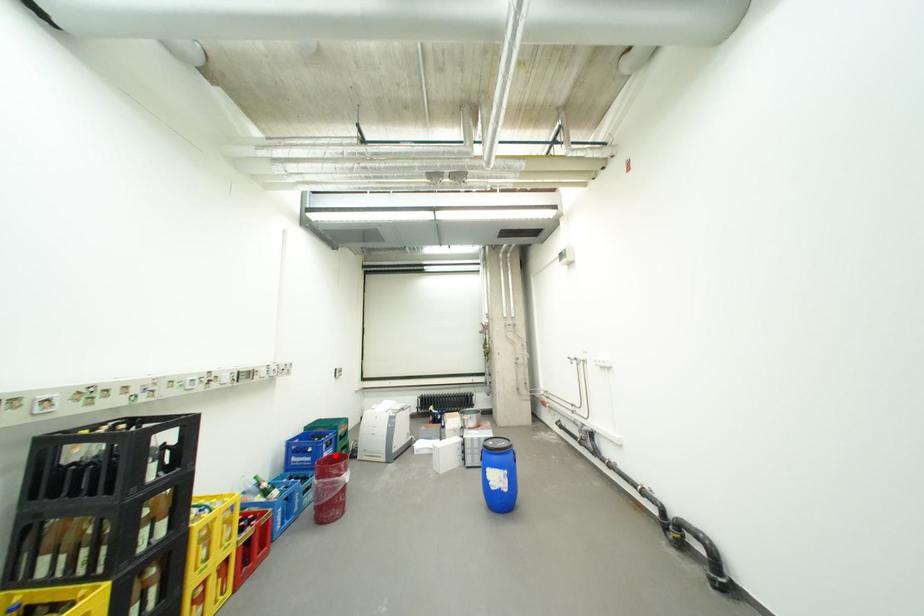
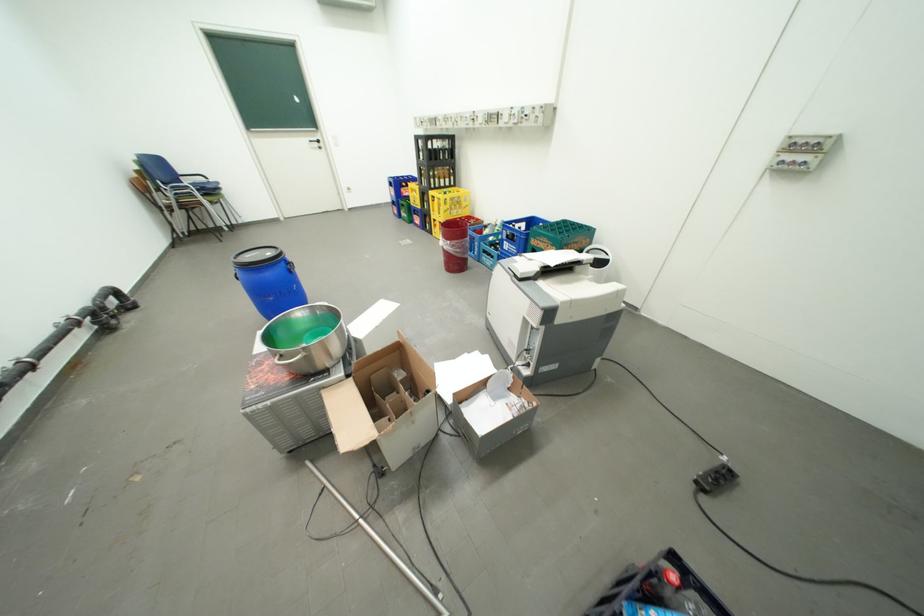
Question: I am providing you with two images of the same scene from different viewpoints. Image1 has a red point marked. In image2, the corresponding 3D location appears at what relative position? Reply with the corresponding letter.

Choices:
 (A) Closer
 (B) Farther

Answer: (B)